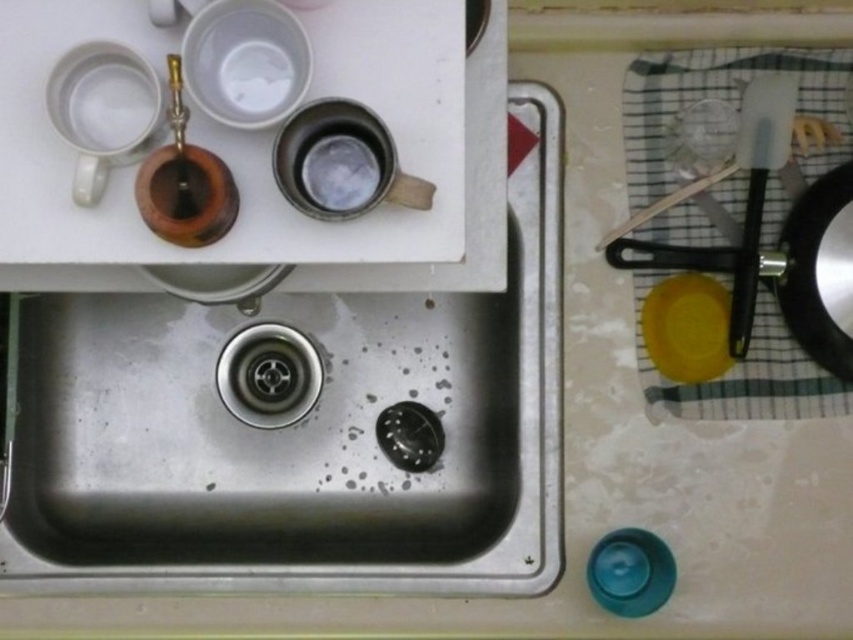
You are a person standing in front of the kitchen countertop. You want to wash your hands but cannot move any objects on the counter. Is the stainless steel sink at center within arm reach?

The stainless steel sink at center is 86.48 centimeters away from viewer. Since the average arm length for an adult is about 60 cm, the sink is out of arm reach. You would need to move closer to reach it.